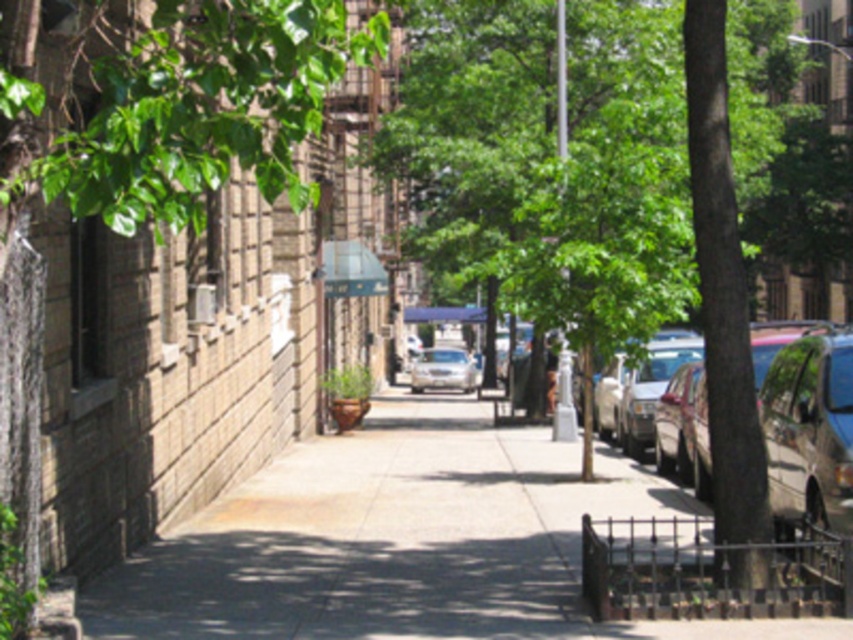
You are standing at the corner of the street and want to locate the metallic silver car at right. According to the coordinates provided, where would you find it?

The metallic silver car at right is located at coordinates point (805,424).

You are standing at the corner of the street and want to park your car. The parking spot is at point (805, 424). What is the color of the car currently occupying that spot?

The metallic silver car at right is located at point (805, 424).

You are standing on the sidewalk in the urban street scene. There are two points marked on the ground ahead of you. The first point is at coordinates point (740, 621) and the second point is at point (840, 384). Which of these two points is closer to you?

Point (740, 621) is closer to the viewer than point (840, 384).